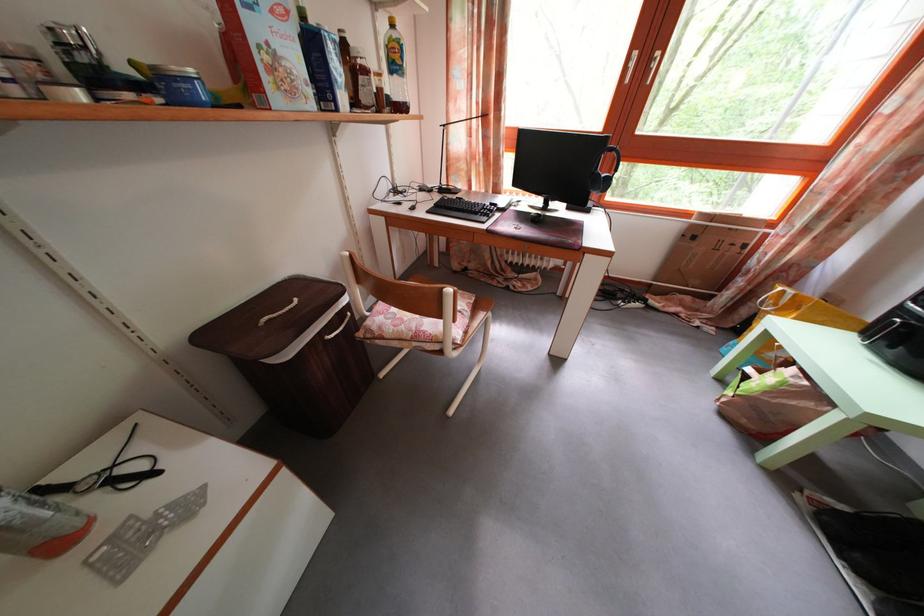
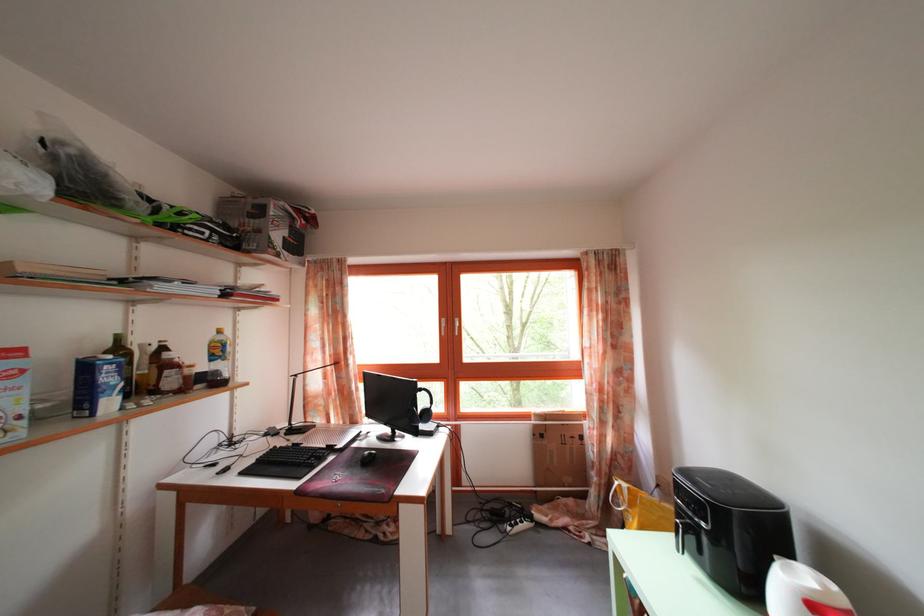
Locate, in the second image, the point that corresponds to (x=350, y=105) in the first image.

(117, 410)